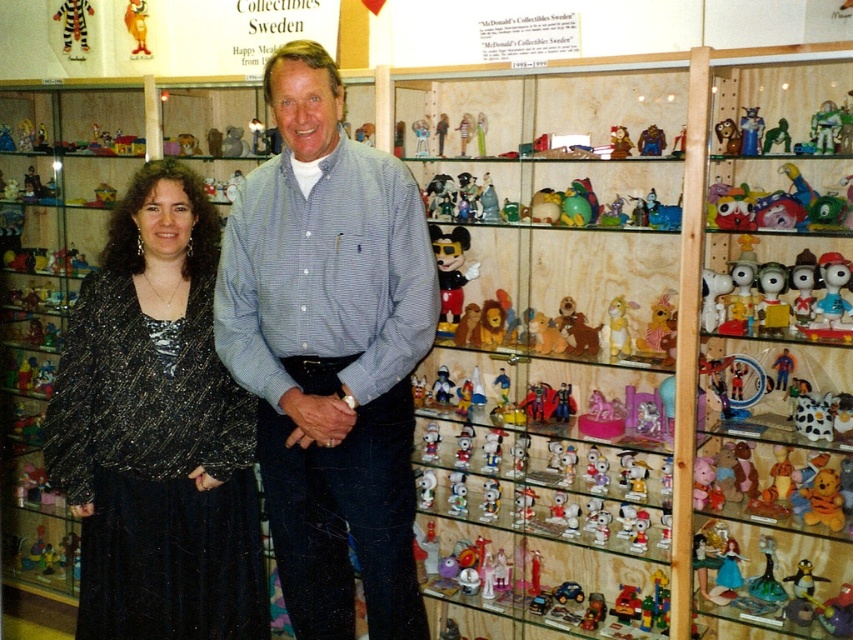
You are a delivery person who needs to place a package on the translucent glass toys at center. The package is 1.8 meters long. Can you place it without exceeding the space available?

The distance between the translucent glass toys at center and the viewer is 2.02 meters. Since the package is 1.8 meters long, it can be placed within the available space as it is shorter than the distance provided.

You are a photographer trying to capture a photo of the translucent glass toys at center and the light blue striped shirt at center. If you want to ensure both are fully visible in the frame, which object should you focus on first to avoid blurring due to size differences?

The translucent glass toys at center are wider than the light blue striped shirt at center, so you should focus on the translucent glass toys at center first to ensure proper focus and avoid blurring.

You are a photographer taking a picture of the translucent glass toys at center and the light blue striped shirt at center. Which object should you focus on first if you want to capture both in the same frame without moving the camera?

You should focus on the light blue striped shirt at center first because the translucent glass toys at center is to the right of it, so adjusting focus from left to right would ensure both are in frame.